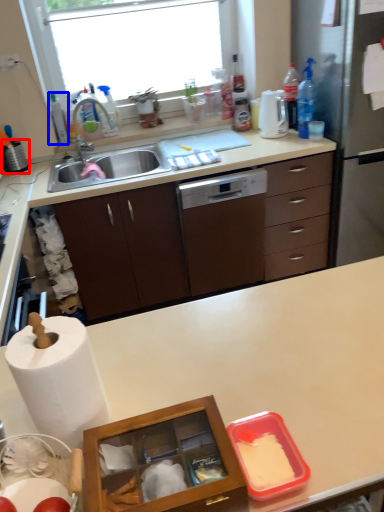
Question: Which of the following is the farthest to the observer, appliance (highlighted by a red box) or bottle (highlighted by a blue box)?

Choices:
 (A) appliance
 (B) bottle

Answer: (B)